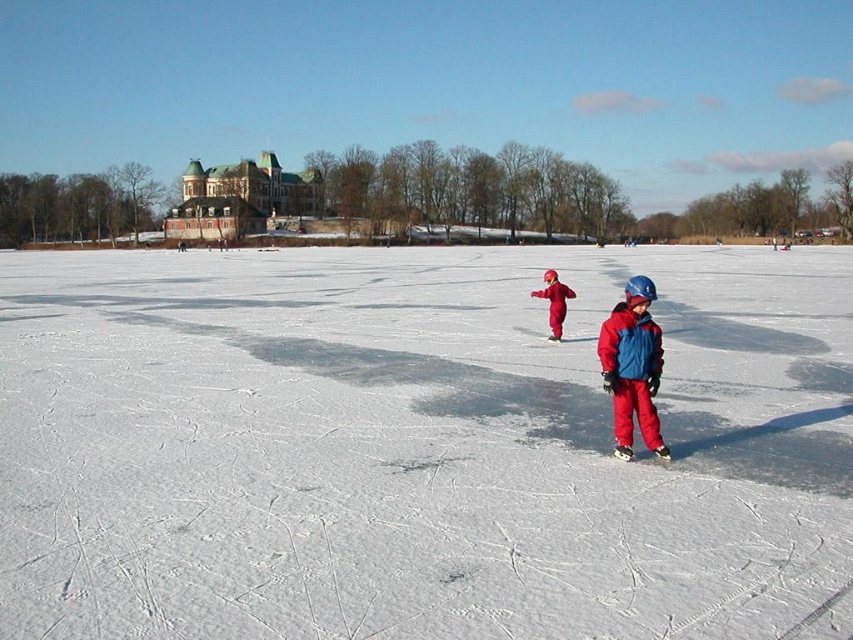
You are standing on the frozen lake and want to reach the point marked at coordinates [659,353]. Given that the ice is safe for walking up to 25 feet away from you, is this point within a safe distance?

The point marked at coordinates [659,353] is 22.38 feet from the viewer, which is within the safe distance of 25 feet. Therefore, it is safe to walk to that point.

Looking at this image, you are a photographer standing on the frozen lake. You see the white smooth ice at center and the matte blue helmet at center. Which object appears taller from your perspective?

The white smooth ice at center appears taller than the matte blue helmet at center because it is much taller as described.

You are a photographer trying to capture both the red fleece jacket at lower right and the matte red snowsuit at center in a single frame. Based on their positions, which object should you focus on first to ensure both are in focus?

The red fleece jacket at lower right is closer to the viewer than the matte red snowsuit at center. To ensure both are in focus, you should focus on the matte red snowsuit at center first, as focusing on the farther object allows the closer one to stay in focus due to the depth of field.